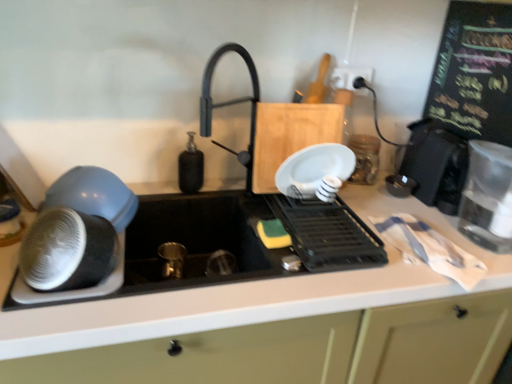
Identify the location of vacant space situated on the left part of black matte soap dispenser at center. This screenshot has height=384, width=512. (154, 189).